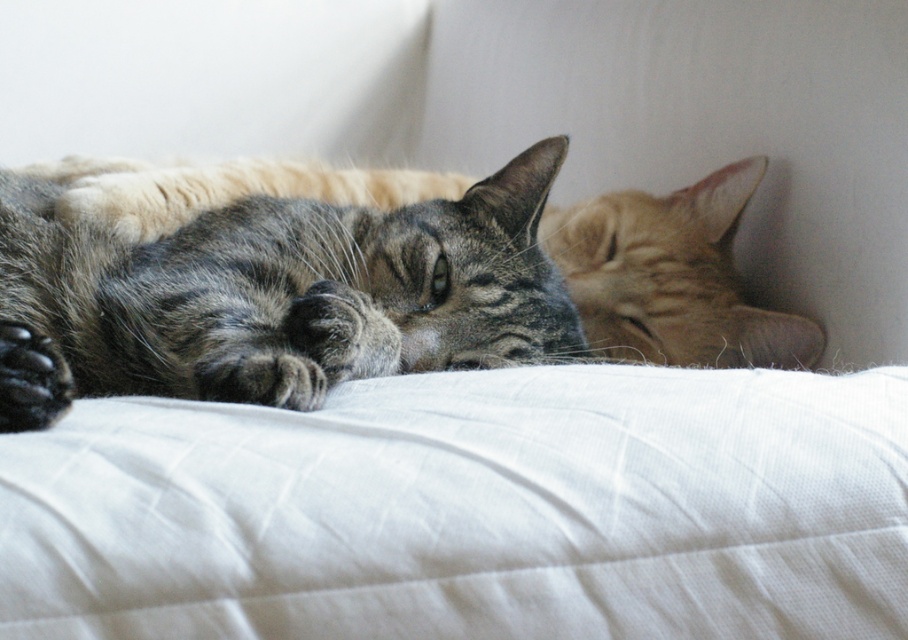
Question: Does tabby fur cat at center appear over black fur paw at lower left?

Choices:
 (A) no
 (B) yes

Answer: (B)

Question: Does white quilted pillow at center appear over black fur paw at lower left?

Choices:
 (A) yes
 (B) no

Answer: (B)

Question: Considering the real-world distances, which object is closest to the black fur paw at lower left?

Choices:
 (A) tabby fur cat at center
 (B) white quilted pillow at center

Answer: (B)

Question: Which point appears closest to the camera in this image?

Choices:
 (A) (38, 339)
 (B) (541, 200)
 (C) (374, 582)

Answer: (C)

Question: Can you confirm if white quilted pillow at center is positioned below tabby fur cat at center?

Choices:
 (A) yes
 (B) no

Answer: (A)

Question: Based on their relative distances, which object is nearer to the white quilted pillow at center?

Choices:
 (A) black fur paw at lower left
 (B) tabby fur cat at center

Answer: (B)